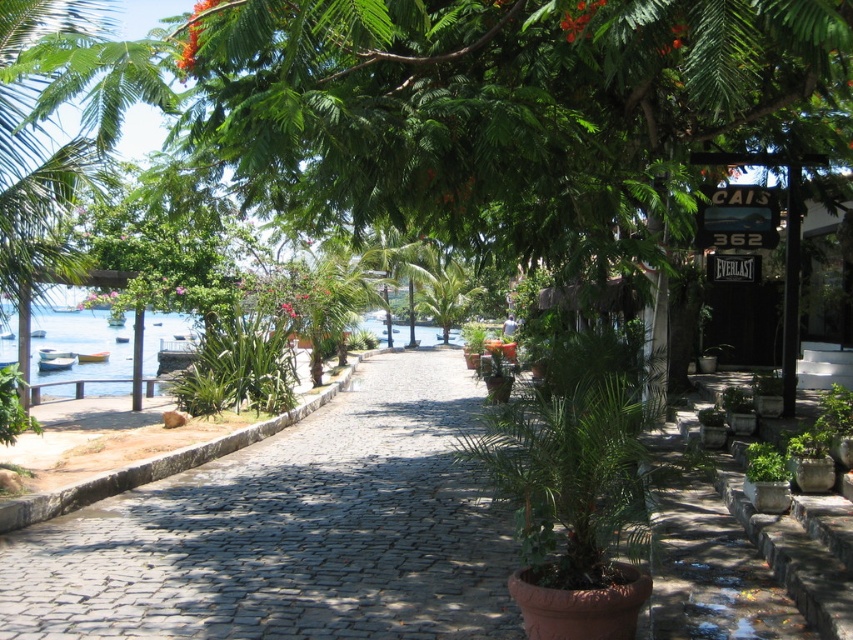
Question: Which point appears farthest from the camera in this image?

Choices:
 (A) (676, 20)
 (B) (206, 552)

Answer: (B)

Question: Which point appears farthest from the camera in this image?

Choices:
 (A) (723, 84)
 (B) (19, 556)

Answer: (B)

Question: From the image, what is the correct spatial relationship of green leafy tree at center in relation to cobblestone pavement at center?

Choices:
 (A) right
 (B) left

Answer: (A)

Question: Is green leafy tree at center to the right of cobblestone pavement at center from the viewer's perspective?

Choices:
 (A) no
 (B) yes

Answer: (B)

Question: Does green leafy tree at center come in front of cobblestone pavement at center?

Choices:
 (A) yes
 (B) no

Answer: (B)